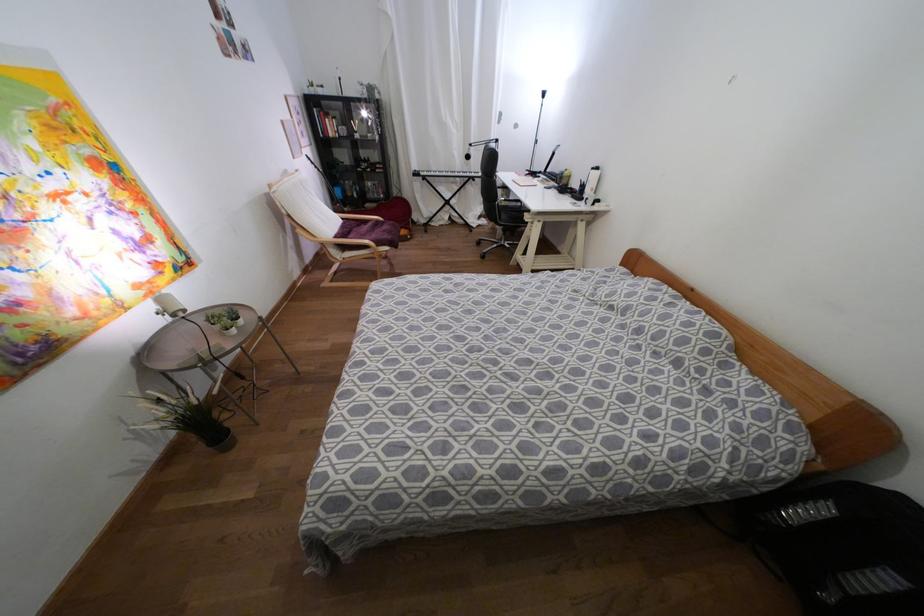
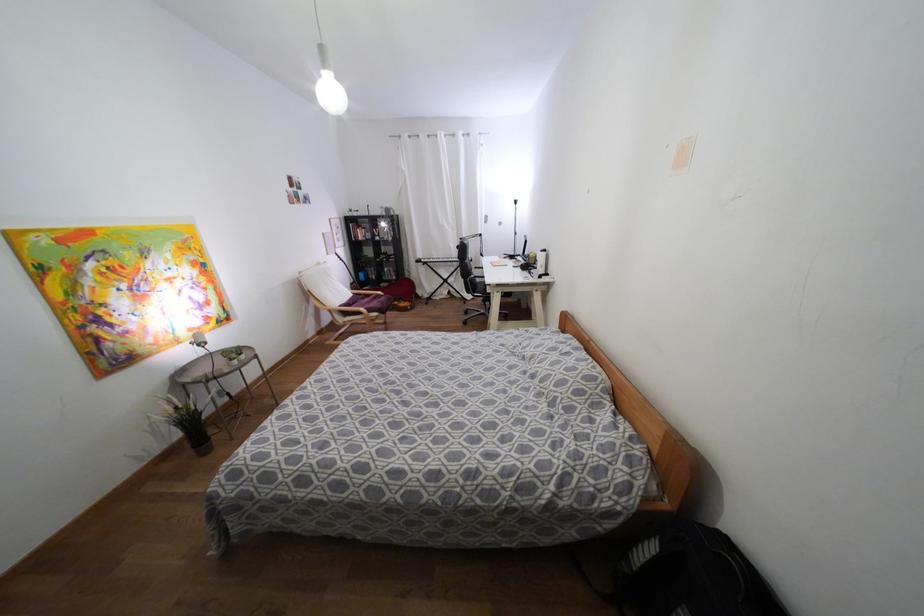
Locate, in the second image, the point that corresponds to [384,225] in the first image.

(382, 299)